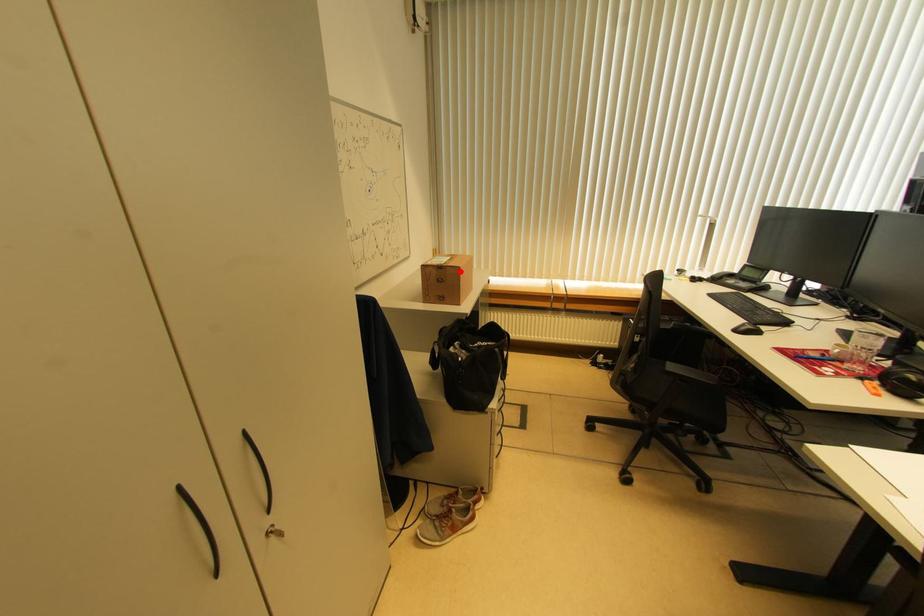
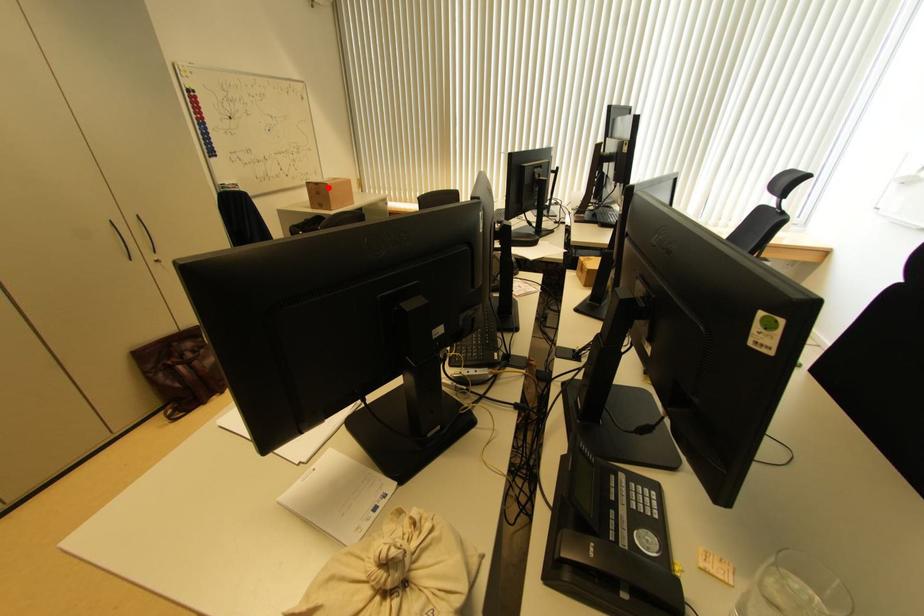
I am providing you with two images of the same scene from different viewpoints. A red point is marked on the first image and another point is marked on the second image. Is the red point in image1 aligned with the point shown in image2?

Yes